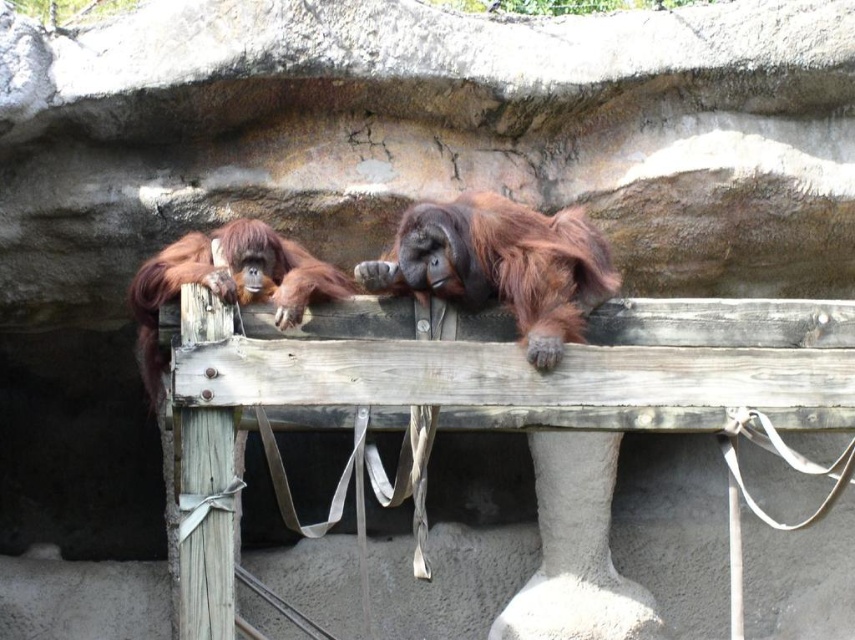
You are a zookeeper trying to locate the orange fur orangutan at center in the enclosure. Based on the coordinates provided, where would you find it in the image?

The orange fur orangutan at center is located at the 2D coordinates point (500,266) in the image.

You are a zookeeper who needs to feed two orange fur orangutans. You have a feeding stick that can reach up to 3 meters. If you are standing next to the orange fur orangutan at left, can you feed the orange fur orangutan at center with the stick?

The orange fur orangutan at center is 3.69 meters away from the orange fur orangutan at left. Since the feeding stick can only reach up to 3 meters, the zookeeper cannot reach the orange fur orangutan at center from the orange fur orangutan at left.

You are a zookeeper observing two orange fur orangutans in their enclosure. You need to approach the orange fur orangutan at center and the orange fur orangutan at left. Which orangutan should you approach first to minimize the distance walked?

You should approach the orange fur orangutan at center first because it is closer to you than the orange fur orangutan at left, so reaching it requires less walking distance.